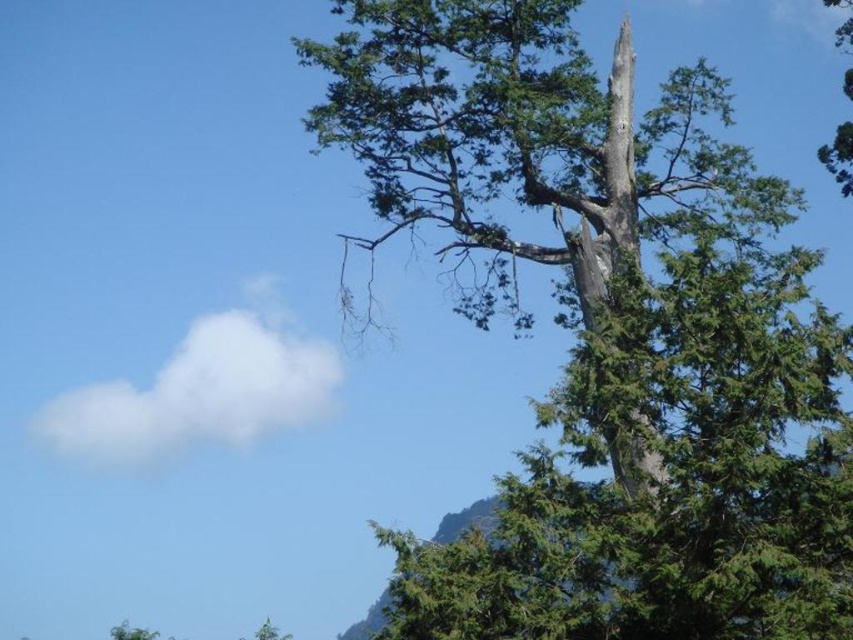
You are an environmental scientist studying the tree structures in this landscape. You observe the green rough bark tree at upper right and the gray bark tree trunk at upper right. Which of these two objects is positioned lower in the image?

The green rough bark tree at upper right is positioned lower than the gray bark tree trunk at upper right in the image.

You are an observer looking at the landscape. You notice the gray bark tree trunk at upper right and the green textured tree at upper right. Which of these two objects is positioned lower in the image?

The gray bark tree trunk at upper right is located below the green textured tree at upper right, so it is positioned lower in the image.